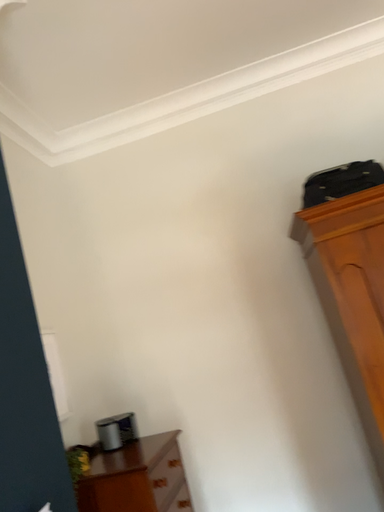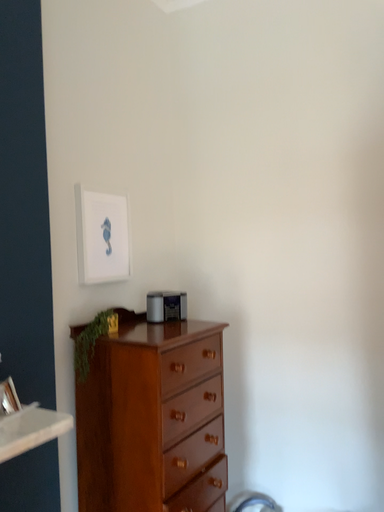
Question: Which way did the camera rotate in the video?

Choices:
 (A) rotated right
 (B) rotated left

Answer: (B)